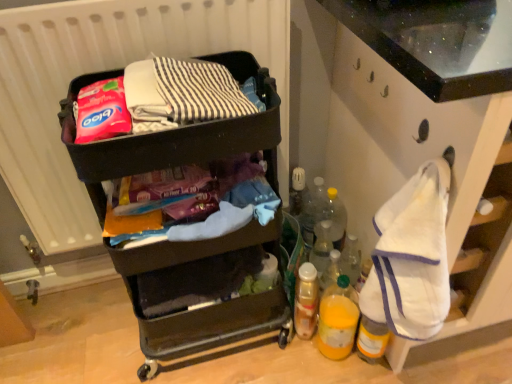
Question: Is translucent plastic bottle at lower right, the 2th bottle in the top-to-bottom sequence, not close to white matte radiator at upper left?

Choices:
 (A) yes
 (B) no

Answer: (B)

Question: Is translucent plastic bottle at lower right, the 2th bottle in the top-to-bottom sequence, turned away from white matte radiator at upper left?

Choices:
 (A) no
 (B) yes

Answer: (B)

Question: Can you confirm if translucent plastic bottle at lower right, the third bottle from the bottom, is shorter than white matte radiator at upper left?

Choices:
 (A) yes
 (B) no

Answer: (A)

Question: From a real-world perspective, is translucent plastic bottle at lower right, the 2th bottle in the top-to-bottom sequence, located higher than white matte radiator at upper left?

Choices:
 (A) no
 (B) yes

Answer: (A)

Question: From the image's perspective, is translucent plastic bottle at lower right, the 2th bottle in the top-to-bottom sequence, beneath white matte radiator at upper left?

Choices:
 (A) no
 (B) yes

Answer: (B)

Question: From a real-world perspective, is matte plastic cart at center, which is the 2th waste from top to bottom, above or below translucent plastic spray can at lower center, which is counted as the 3th bottle, starting from the top?

Choices:
 (A) below
 (B) above

Answer: (B)

Question: In terms of width, does matte plastic cart at center, the first waste ordered from the bottom, look wider or thinner when compared to translucent plastic spray can at lower center, which is counted as the 3th bottle, starting from the top?

Choices:
 (A) thin
 (B) wide

Answer: (B)

Question: Is matte plastic cart at center, the first waste ordered from the bottom, taller or shorter than translucent plastic spray can at lower center, which is counted as the 3th bottle, starting from the top?

Choices:
 (A) tall
 (B) short

Answer: (B)

Question: Is matte plastic cart at center, the first waste ordered from the bottom, in front of or behind translucent plastic spray can at lower center, which is counted as the 3th bottle, starting from the top, in the image?

Choices:
 (A) front
 (B) behind

Answer: (A)

Question: Is translucent yellow bottle at lower right, the 1th bottle when ordered from bottom to top, taller or shorter than translucent plastic bottle at lower right, the 2th bottle in the top-to-bottom sequence?

Choices:
 (A) short
 (B) tall

Answer: (B)

Question: Does point (317, 347) appear closer or farther from the camera than point (333, 248)?

Choices:
 (A) closer
 (B) farther

Answer: (A)

Question: Considering their positions, is translucent yellow bottle at lower right, the 1th bottle when ordered from bottom to top, located in front of or behind translucent plastic bottle at lower right, the third bottle from the bottom?

Choices:
 (A) behind
 (B) front

Answer: (B)

Question: From the image's perspective, is translucent yellow bottle at lower right, the 1th bottle when ordered from bottom to top, above or below translucent plastic bottle at lower right, the 2th bottle in the top-to-bottom sequence?

Choices:
 (A) above
 (B) below

Answer: (B)

Question: From the image's perspective, is translucent plastic bottle at lower right, the 1th bottle from the top, positioned above or below white fabric at right?

Choices:
 (A) above
 (B) below

Answer: (A)

Question: Based on their positions, is translucent plastic bottle at lower right, which is counted as the fourth bottle, starting from the bottom, located to the left or right of white fabric at right?

Choices:
 (A) left
 (B) right

Answer: (A)